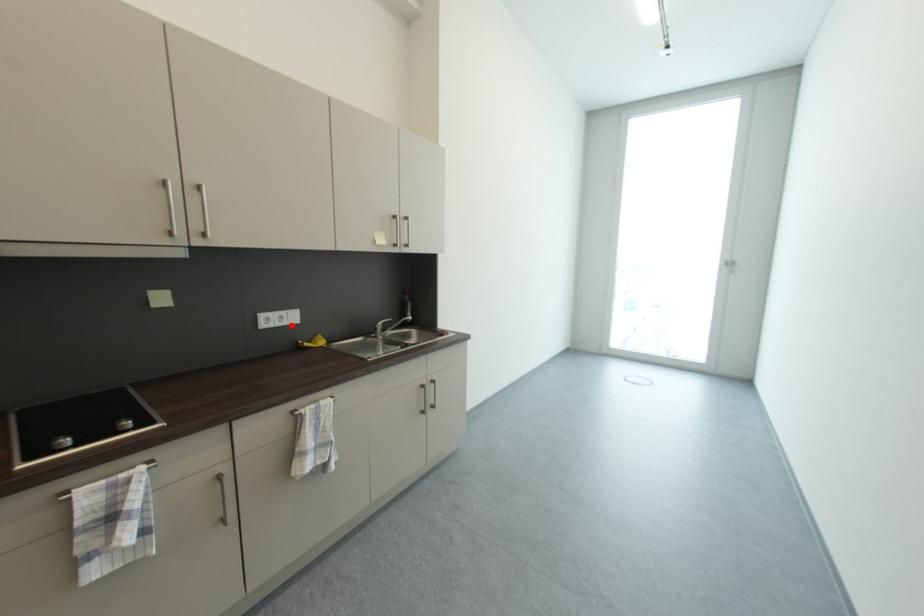
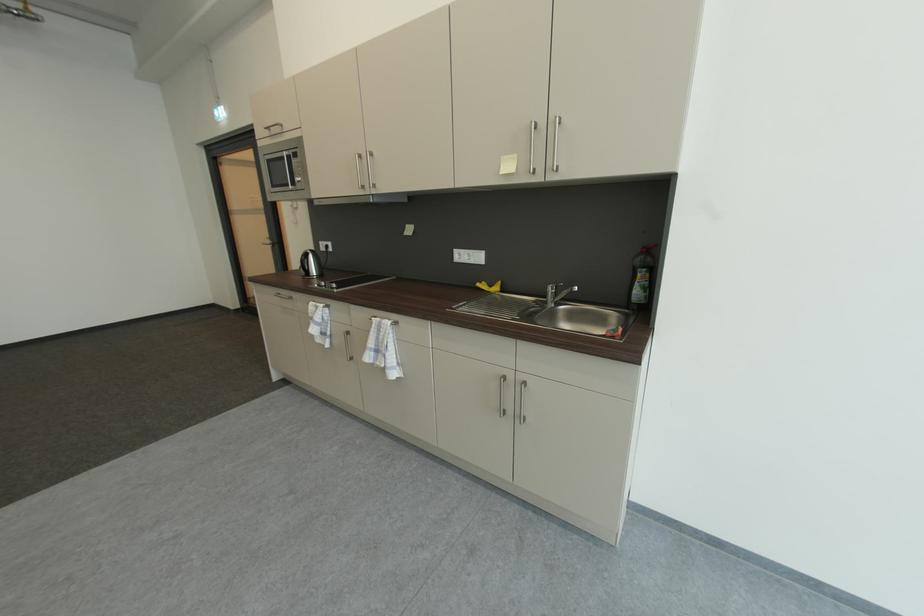
Find the pixel in the second image that matches the highlighted location in the first image.

(479, 262)